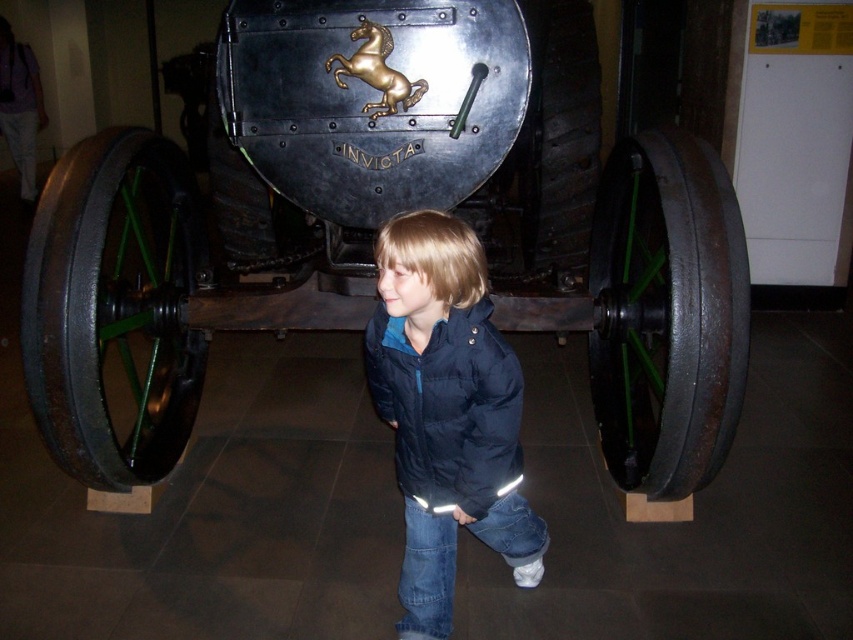
Can you confirm if polished metal cannon at center is shorter than navy blue jacket at center?

In fact, polished metal cannon at center may be taller than navy blue jacket at center.

Is point (630, 134) farther from camera compared to point (433, 337)?

Yes, point (630, 134) is farther from viewer.

The width and height of the screenshot is (853, 640). Identify the location of polished metal cannon at center. (386, 218).